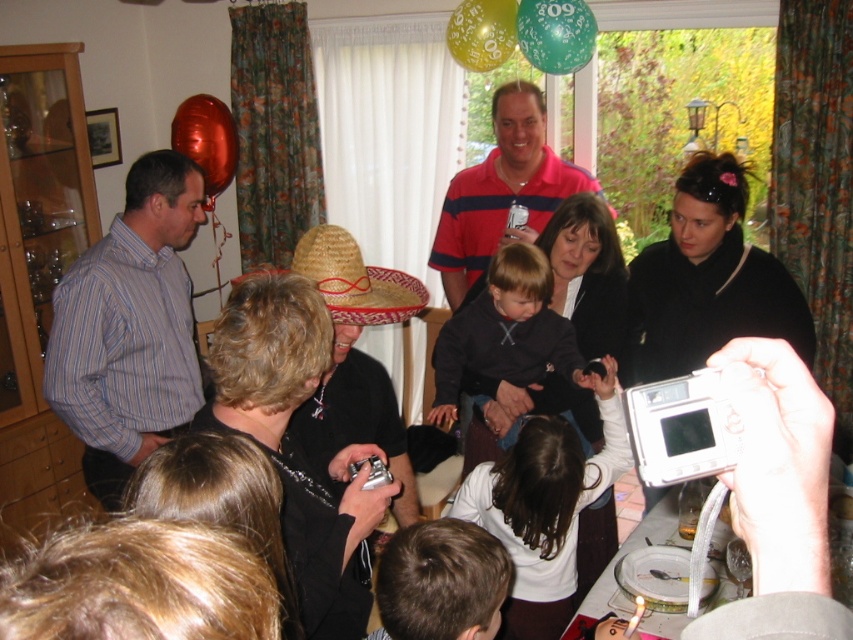
Question: Is striped cotton shirt at left in front of red striped polo shirt at center?

Choices:
 (A) no
 (B) yes

Answer: (B)

Question: Which of the following is the closest to the observer?

Choices:
 (A) white cotton shirt at center
 (B) striped cotton shirt at left

Answer: (A)

Question: Can you confirm if striped cotton shirt at left is positioned to the left of dark blue sweater at center?

Choices:
 (A) yes
 (B) no

Answer: (A)

Question: Which of the following is the farthest from the observer?

Choices:
 (A) (479, 316)
 (B) (474, 256)
 (C) (508, 467)
 (D) (149, 173)

Answer: (B)

Question: Can you confirm if striped cotton shirt at left is wider than red striped polo shirt at center?

Choices:
 (A) no
 (B) yes

Answer: (A)

Question: Which of the following is the farthest from the observer?

Choices:
 (A) red striped polo shirt at center
 (B) dark blue sweater at center
 (C) striped cotton shirt at left
 (D) white cotton shirt at center

Answer: (A)